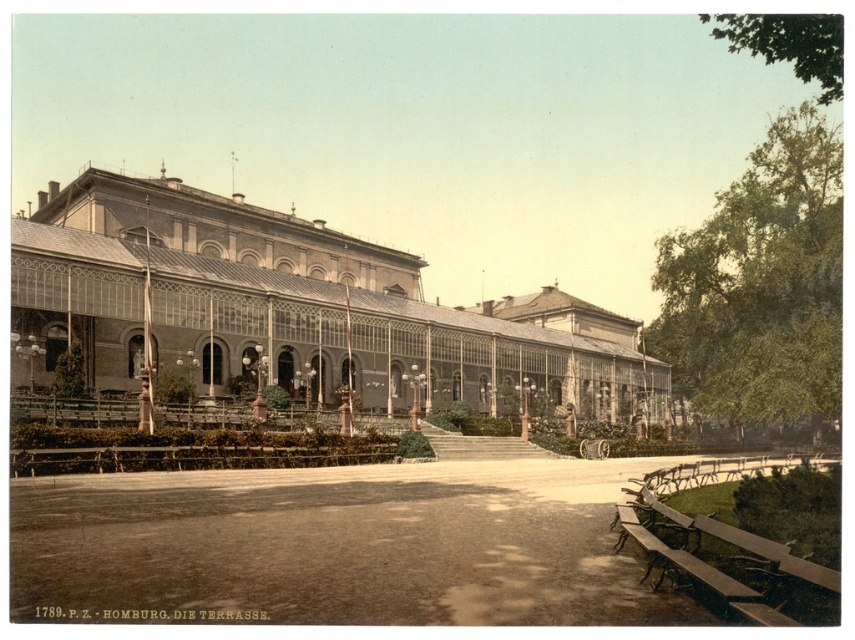
Can you confirm if matte glass palace at center is shorter than wooden park bench at lower right?

No.

Based on the photo, is matte glass palace at center closer to camera compared to wooden park bench at lower right?

No, it is behind wooden park bench at lower right.

Locate an element on the screen. matte glass palace at center is located at coordinates (298, 307).